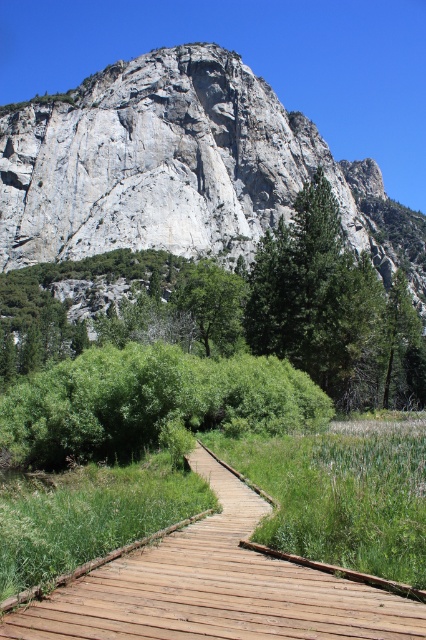
Is point (42, 612) less distant than point (224, 289)?

Yes, it is in front of point (224, 289).

Between brown wooden boardwalk at center and green leafy tree at center, which one has less height?

Standing shorter between the two is brown wooden boardwalk at center.

Locate an element on the screen. brown wooden boardwalk at center is located at coordinates (219, 586).

Who is more distant from viewer, (215, 109) or (176, 300)?

Positioned behind is point (215, 109).

Is gray rock formation at upper center to the right of green leafy tree at center from the viewer's perspective?

Yes, gray rock formation at upper center is to the right of green leafy tree at center.

Between point (157, 148) and point (173, 301), which one is positioned in front?

Positioned in front is point (173, 301).

Locate an element on the screen. gray rock formation at upper center is located at coordinates (181, 168).

Is point (71, 208) closer to camera compared to point (207, 636)?

No, it is not.

Can you confirm if gray rock formation at upper center is wider than brown wooden boardwalk at center?

Correct, the width of gray rock formation at upper center exceeds that of brown wooden boardwalk at center.

Between point (354, 195) and point (181, 566), which one is positioned behind?

Positioned behind is point (354, 195).

At what (x,y) coordinates should I click in order to perform the action: click on gray rock formation at upper center. Please return your answer as a coordinate pair (x, y). Looking at the image, I should click on (181, 168).